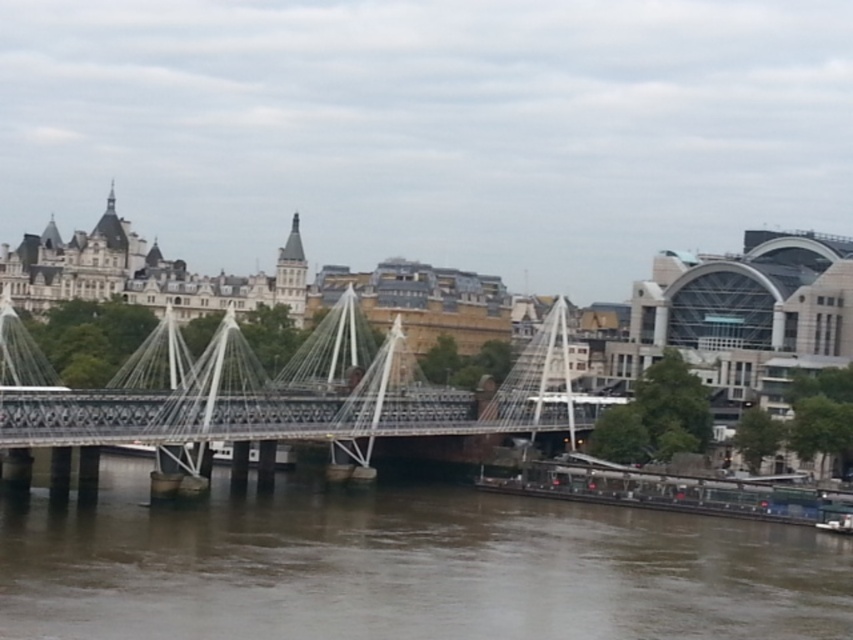
Question: Is brown murky water at center thinner than metallic silver suspension bridge at center?

Choices:
 (A) no
 (B) yes

Answer: (A)

Question: Which object appears closest to the camera in this image?

Choices:
 (A) brown murky water at center
 (B) metallic silver suspension bridge at center

Answer: (A)

Question: Is brown murky water at center further to camera compared to metallic silver suspension bridge at center?

Choices:
 (A) no
 (B) yes

Answer: (A)

Question: Is brown murky water at center above metallic silver suspension bridge at center?

Choices:
 (A) yes
 (B) no

Answer: (B)

Question: Which point is farther to the camera?

Choices:
 (A) metallic silver suspension bridge at center
 (B) brown murky water at center

Answer: (A)